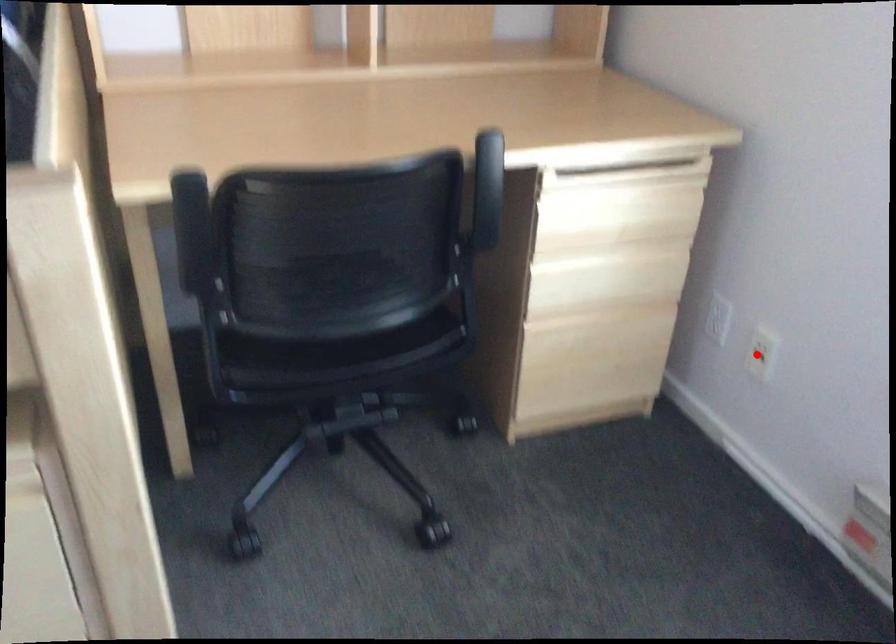
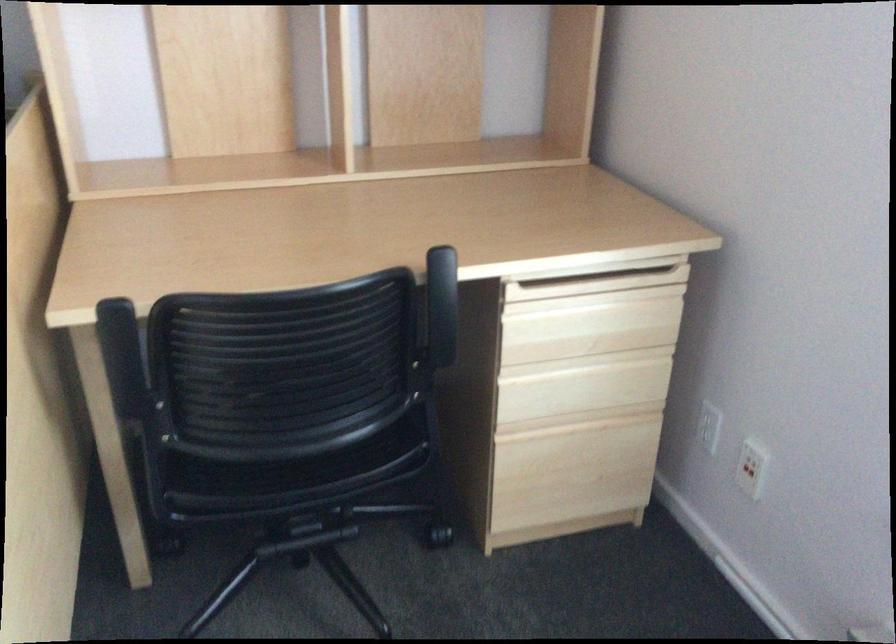
Where in the second image is the point corresponding to the highlighted location from the first image?

(747, 469)